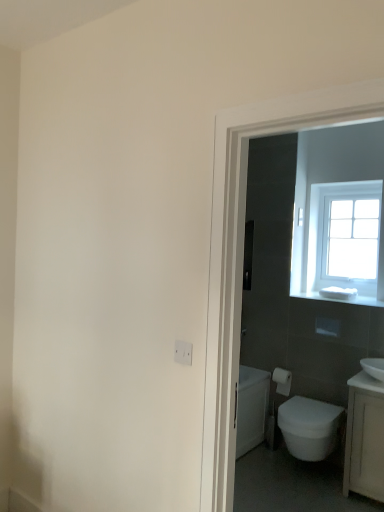
Question: Would you say white plastic electric outlet at lower center is inside or outside white glossy bidet at lower right?

Choices:
 (A) outside
 (B) inside

Answer: (A)

Question: Does point (180, 357) appear closer or farther from the camera than point (291, 419)?

Choices:
 (A) closer
 (B) farther

Answer: (A)

Question: Considering the real-world distances, which object is closest to the white matte toilet paper at right?

Choices:
 (A) white glossy sink at right
 (B) white glossy sink at right
 (C) white plastic electric outlet at lower center
 (D) clear glass window at upper right
 (E) white glossy bidet at lower right

Answer: (E)

Question: Which object is positioned closest to the white plastic electric outlet at lower center?

Choices:
 (A) white glossy sink at right
 (B) white glossy bidet at lower right
 (C) white glossy sink at right
 (D) clear glass window at upper right
 (E) white matte toilet paper at right

Answer: (A)